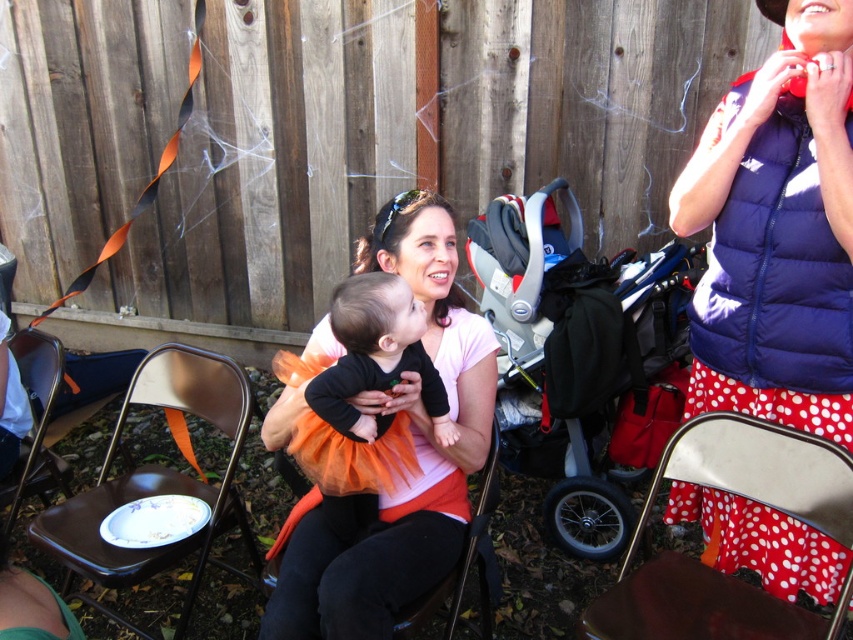
Question: Which of the following is the closest to the observer?

Choices:
 (A) gray plastic baby carriage at center
 (B) blue puffy vest at upper right
 (C) orange tulle skirt at center
 (D) brown wood chair at lower left

Answer: (C)

Question: Which object appears farthest from the camera in this image?

Choices:
 (A) blue puffy vest at upper right
 (B) metallic silver chair at lower right
 (C) gray plastic baby carriage at center
 (D) brown leather chair at lower left

Answer: (C)

Question: From the image, what is the correct spatial relationship of blue puffy vest at upper right in relation to orange tulle skirt at center?

Choices:
 (A) right
 (B) left

Answer: (A)

Question: Is brown wood chair at lower left wider than brown leather chair at lower left?

Choices:
 (A) no
 (B) yes

Answer: (B)

Question: Which object appears closest to the camera in this image?

Choices:
 (A) metallic silver chair at lower right
 (B) metallic silver chair at center
 (C) orange tulle skirt at center

Answer: (C)

Question: Observing the image, what is the correct spatial positioning of metallic silver chair at lower right in reference to brown wood chair at lower left?

Choices:
 (A) above
 (B) below

Answer: (B)